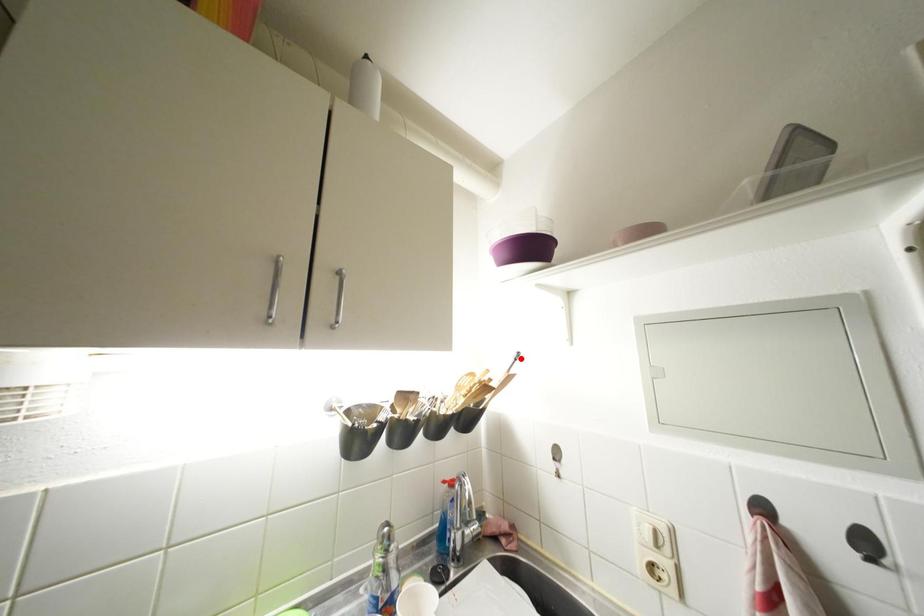
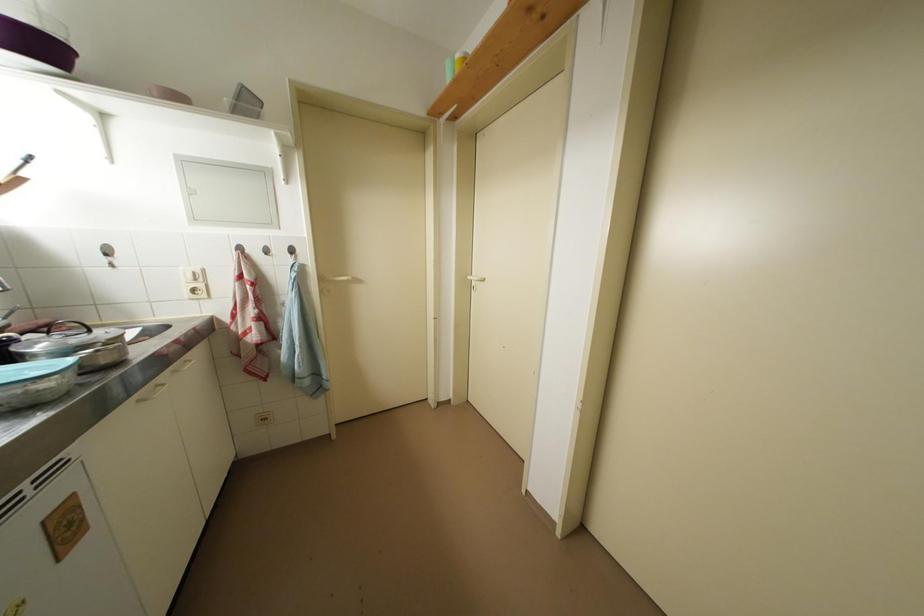
Find the pixel in the second image that matches the highlighted location in the first image.

(30, 160)